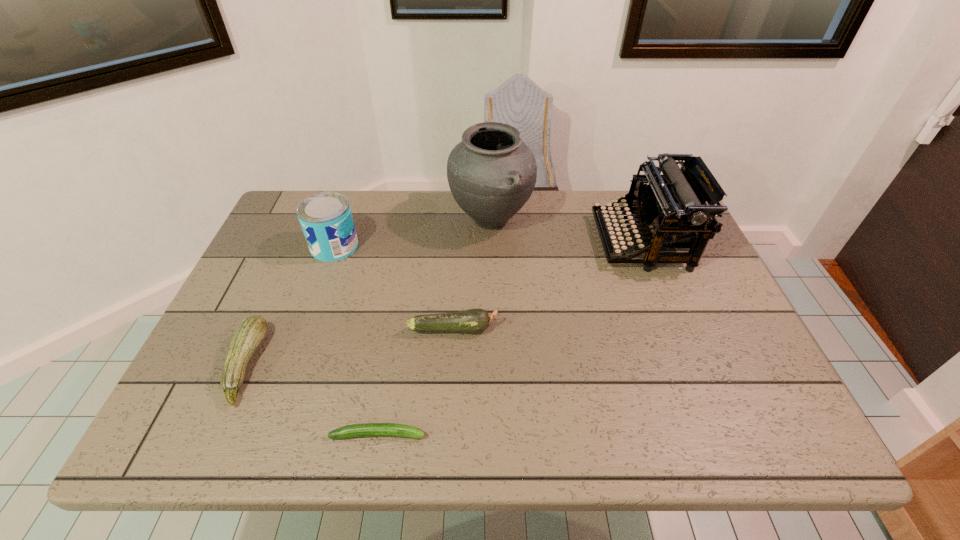
Image resolution: width=960 pixels, height=540 pixels. In order to click on vacant area located 0.080m on the typing side of the typewriter in this screenshot , I will do [x=570, y=242].

The image size is (960, 540). Find the location of `free space located on the typing side of the typewriter`. free space located on the typing side of the typewriter is located at coordinates (560, 242).

Locate an element on the screen. free location located on the right of the second object from left to right is located at coordinates (449, 247).

Find the location of a particular element. vacant space located 0.260m at the stem end of the leftmost object is located at coordinates 376,364.

Locate an element on the screen. vacant space located 0.320m on the front-facing side of the nearest object is located at coordinates (589, 434).

The height and width of the screenshot is (540, 960). I want to click on urn that is positioned at the far edge, so click(x=492, y=173).

The image size is (960, 540). Find the location of `typewriter that is at the far edge`. typewriter that is at the far edge is located at coordinates (671, 207).

Find the location of a particular element. can that is at the far edge is located at coordinates (326, 220).

Locate an element on the screen. The height and width of the screenshot is (540, 960). can at the left edge is located at coordinates (326, 220).

Find the location of `zucchini located in the left edge section of the desktop`. zucchini located in the left edge section of the desktop is located at coordinates (250, 333).